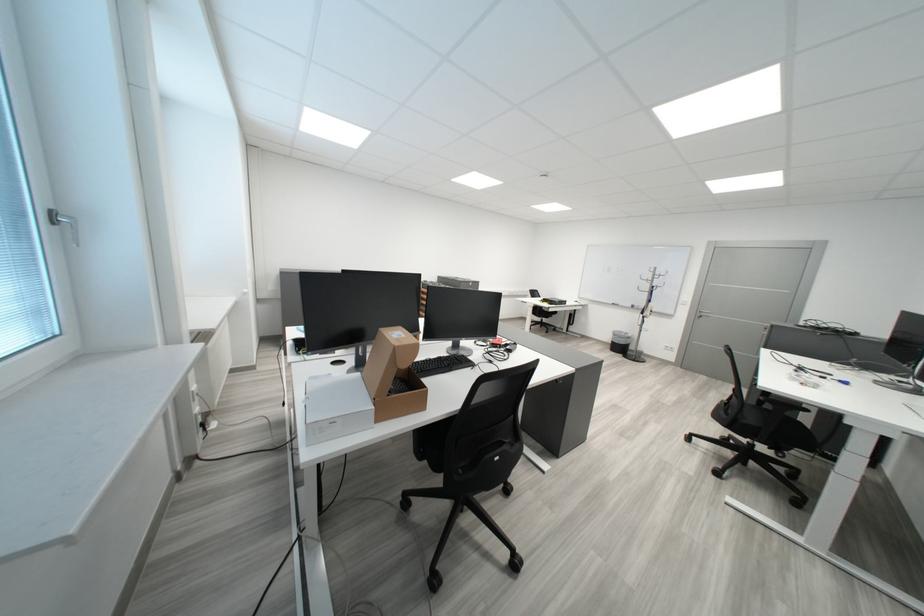
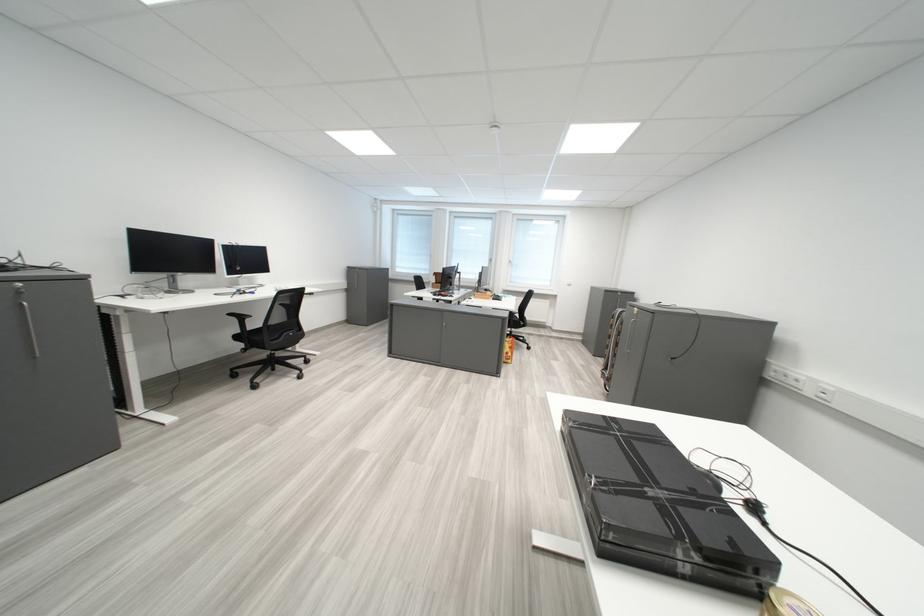
Question: I am providing you with two images of the same scene from different viewpoints. After the viewpoint changes to image2, which objects are now occluded?

Choices:
 (A) black taped box
 (B) small gold container
 (C) red glove
 (D) black computer keyboard

Answer: (D)